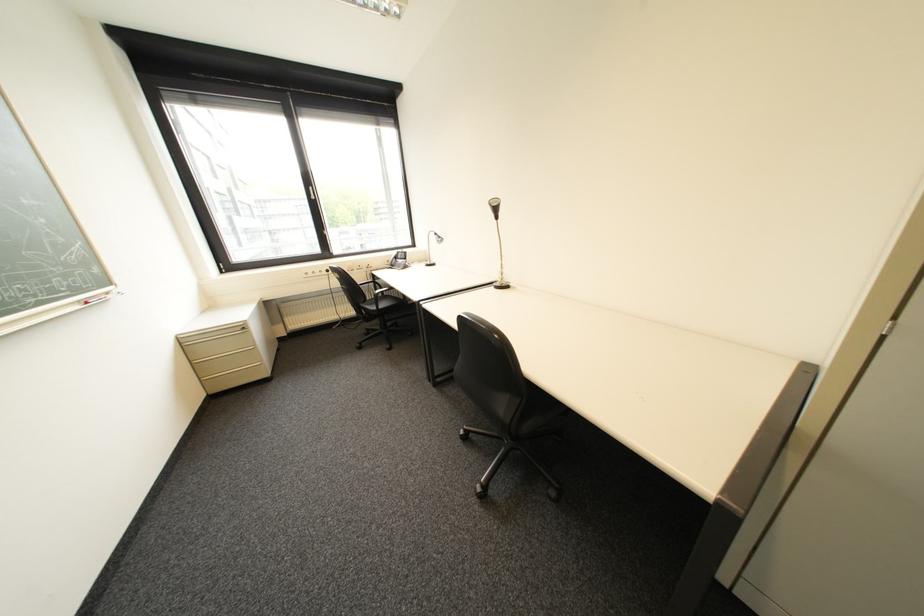
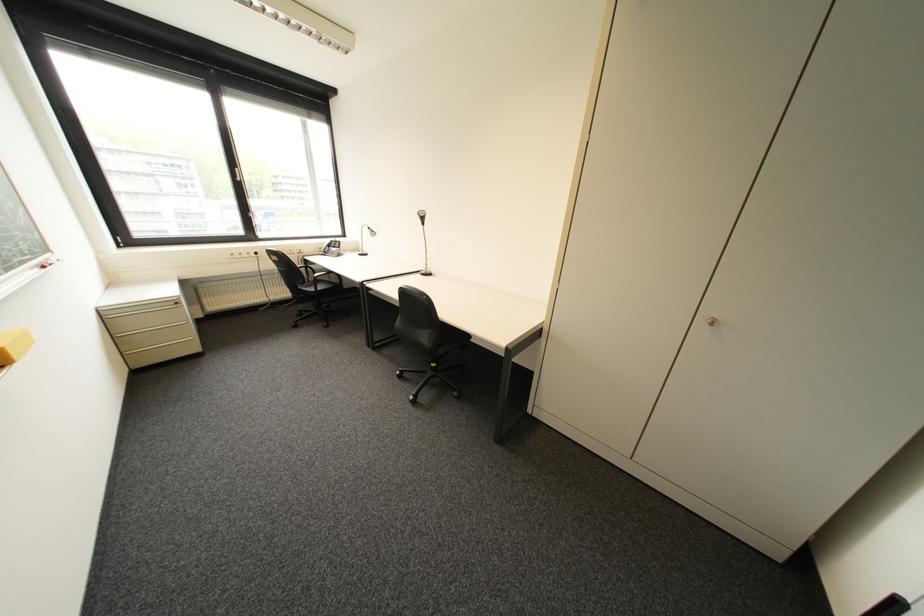
In the second image, find the point that corresponds to [525,416] in the first image.

(444, 342)